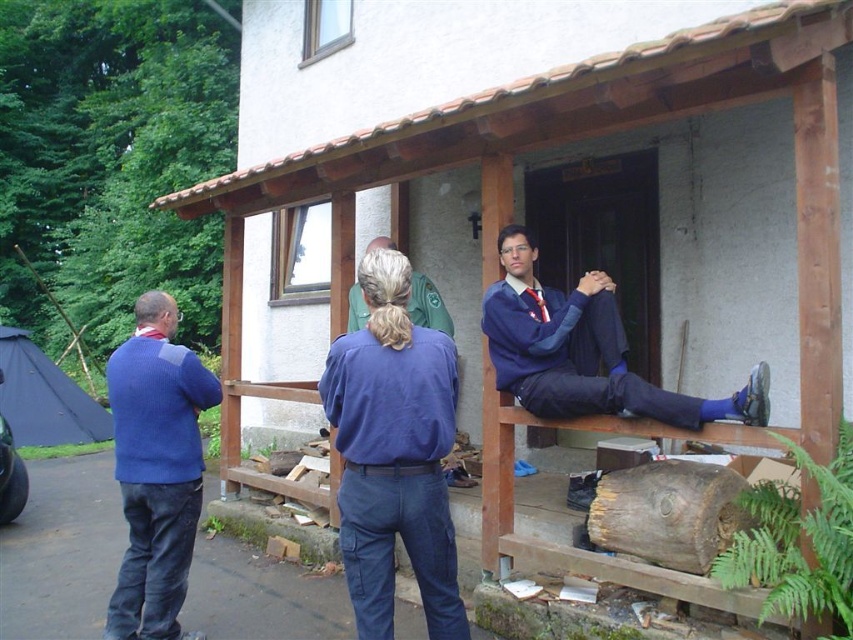
Between point (415, 497) and point (666, 422), which one is positioned behind?

Positioned behind is point (666, 422).

Does point (426, 445) lie in front of point (498, 314)?

That is True.

Does point (397, 477) come farther from viewer compared to point (579, 378)?

No, (397, 477) is closer to viewer.

The width and height of the screenshot is (853, 640). Find the location of `blue cotton shirt at center`. blue cotton shirt at center is located at coordinates (393, 452).

Who is more distant from viewer, [408,445] or [729,499]?

The point [729,499] is more distant.

Between blue cotton shirt at center and brown rough wood log at lower right, which one appears on the right side from the viewer's perspective?

brown rough wood log at lower right is more to the right.

At what (x,y) coordinates should I click in order to perform the action: click on blue cotton shirt at center. Please return your answer as a coordinate pair (x, y). Image resolution: width=853 pixels, height=640 pixels. Looking at the image, I should click on tap(393, 452).

Does brown rough wood log at lower right have a smaller size compared to green fabric jacket at center?

Actually, brown rough wood log at lower right might be larger than green fabric jacket at center.

Is brown rough wood log at lower right closer to the viewer compared to green fabric jacket at center?

Yes, it is.

Between point (647, 468) and point (436, 307), which one is positioned behind?

Point (436, 307)

The height and width of the screenshot is (640, 853). I want to click on brown rough wood log at lower right, so click(x=668, y=513).